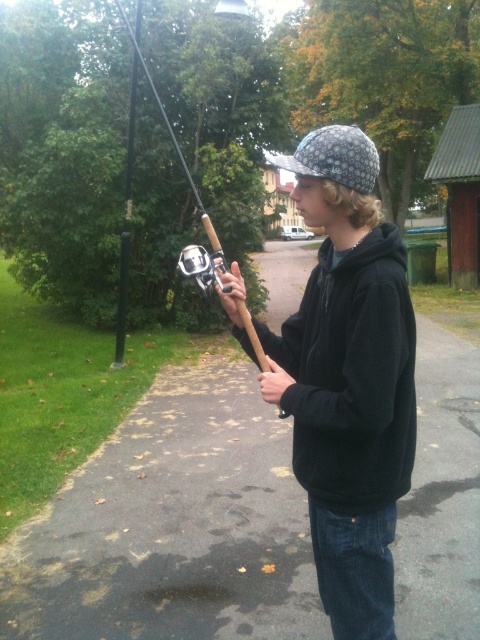
You are a delivery robot with a 1.5 meter wide package. You need to deliver it to the person wearing the matte black hoodie at center. Can you approach them directly along the pathway?

The distance between matte black hoodie at center and the viewer is 1.56 meters. Since the package is 1.5 meters wide, the robot can approach them directly as the pathway is wide enough to accommodate the package.

You are a delivery drone flying over a wet asphalt path at center. You need to land on the path but must avoid any puddles. Based on the coordinates provided, can you safely land at point (172, 525)?

The point (172, 525) indicates the wet asphalt path at center, which is suitable for landing as it specifies the path itself, not a puddle. Avoid areas marked as puddles for a safe landing.

Looking at this image, you are standing on the pathway and see two points marked in the image. Which point is closer to you, point (475, 604) or point (396, 330)?

Point (396, 330) is closer to you because it is in front of point (475, 604).